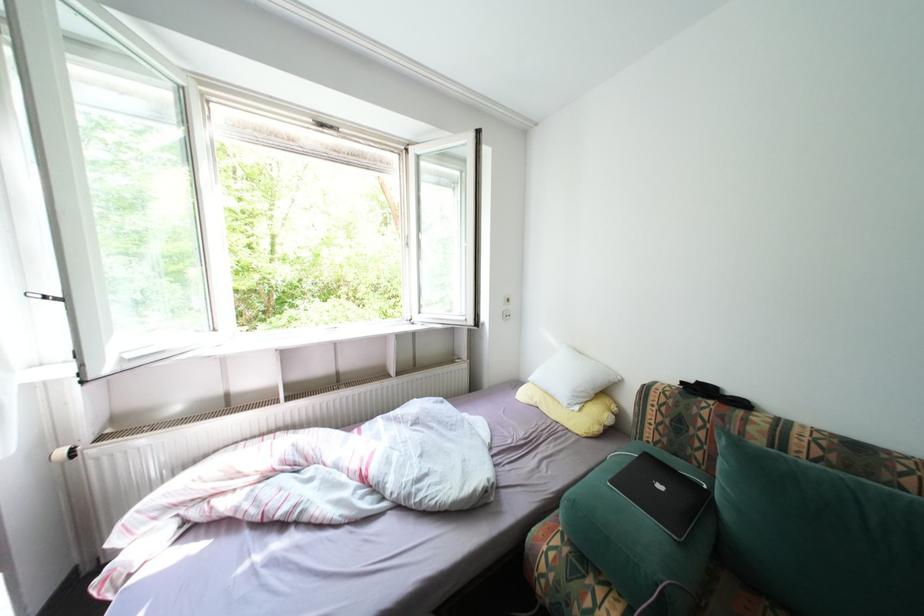
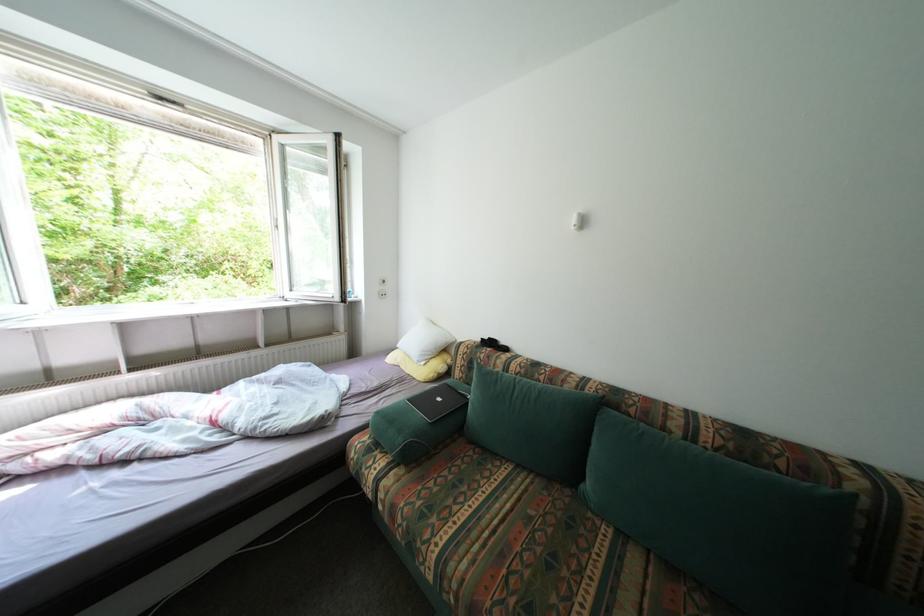
The images are taken continuously from a first-person perspective. In which direction are you moving?

The cameraman moved toward right, backward.